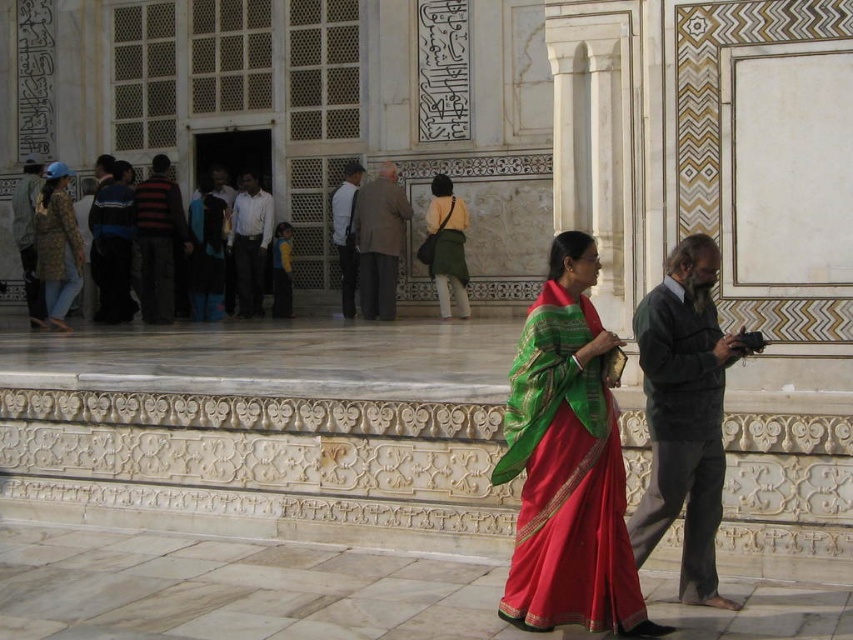
You are standing at the entrance of the historical site and notice two visitors wearing distinct clothing items. The striped sweater at center and the patterned fabric jacket at left. Which clothing item is taller?

The striped sweater at center is taller than the patterned fabric jacket at left.

You are a tour guide leading a group at this historical site. You notice two visitors, one wearing a silky red sari at center and the other in matte black clothing at center. Your group is standing 10 meters away from the entrance. Can your group see both visitors clearly from this distance?

The distance between the silky red sari at center and matte black clothing at center is 20.86 meters. Since your group is only 10 meters from the entrance, they are closer to the entrance than the visitors. However, the exact positions arenot specified, so visibility depends on the layout. If the path is straight and unobstructed, they might see both, but if there are pillars or walls, visibility could be blocked.

You are standing in front of the mosque and want to take a photo that includes both the point at (152, 310) and the point at (57, 204). Which point should you focus on to ensure both are in clear view?

You should focus on the point at (152, 310) because it is closer to the camera, ensuring both points will be in focus.